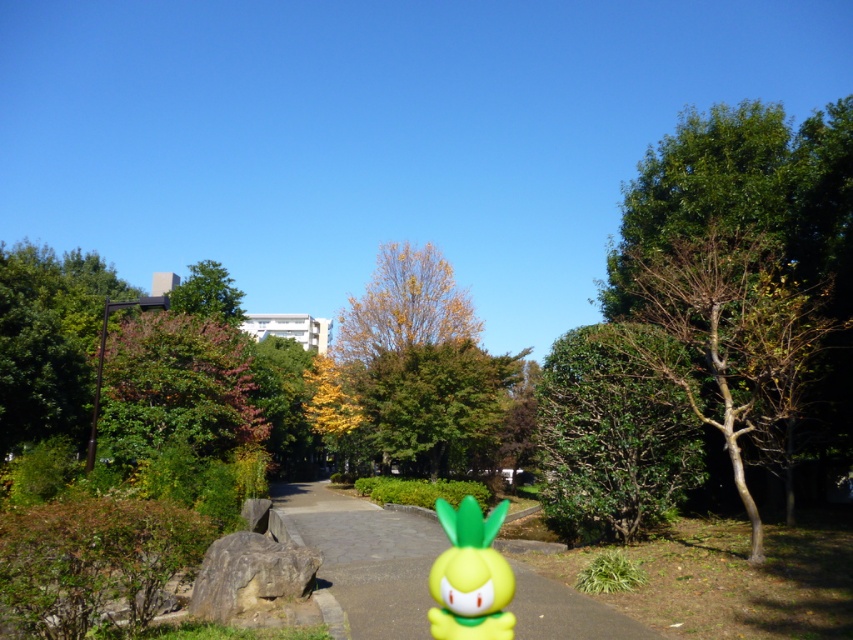
Who is positioned more to the right, brown/dry wood tree at right or smooth concrete pavement at center?

From the viewer's perspective, brown/dry wood tree at right appears more on the right side.

Is brown/dry wood tree at right to the right of smooth concrete pavement at center from the viewer's perspective?

Correct, you'll find brown/dry wood tree at right to the right of smooth concrete pavement at center.

Identify the location of brown/dry wood tree at right. (724, 333).

Which is more to the left, green leafy tree at right or matte yellow toy at center?

matte yellow toy at center is more to the left.

Based on the photo, is green leafy tree at right thinner than matte yellow toy at center?

No.

Describe the element at coordinates (611, 436) in the screenshot. I see `green leafy tree at right` at that location.

Identify the location of green leafy tree at right. (611, 436).

Which of these two, brown/dry wood tree at right or green leafy tree at upper center, stands taller?

With more height is green leafy tree at upper center.

Which of these two, brown/dry wood tree at right or green leafy tree at upper center, stands shorter?

brown/dry wood tree at right is shorter.

You are a GUI agent. You are given a task and a screenshot of the screen. Output one action in this format:
    pyautogui.click(x=<x>, y=<y>)
    Task: Click on the brown/dry wood tree at right
    
    Given the screenshot: What is the action you would take?
    pyautogui.click(x=724, y=333)

At what (x,y) coordinates should I click in order to perform the action: click on brown/dry wood tree at right. Please return your answer as a coordinate pair (x, y). Looking at the image, I should click on (724, 333).